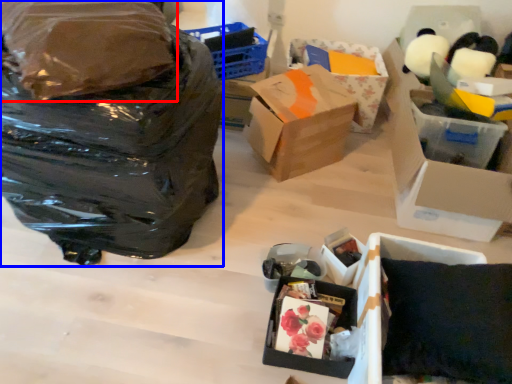
Question: Which of the following is the closest to the observer, plastic bag (highlighted by a red box) or bag (highlighted by a blue box)?

Choices:
 (A) plastic bag
 (B) bag

Answer: (A)